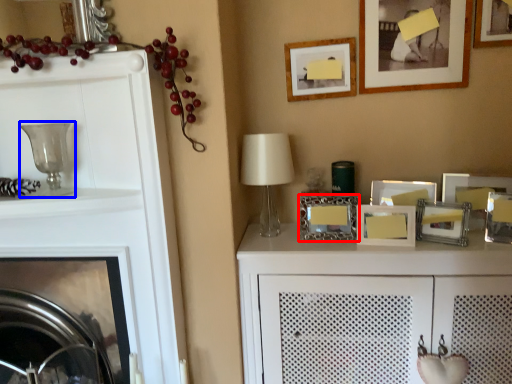
Question: Which object is further to the camera taking this photo, picture frame (highlighted by a red box) or candle holder (highlighted by a blue box)?

Choices:
 (A) picture frame
 (B) candle holder

Answer: (A)